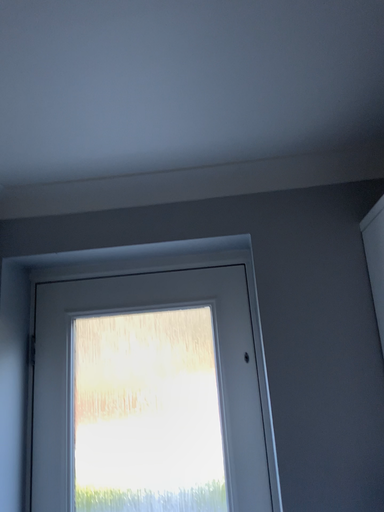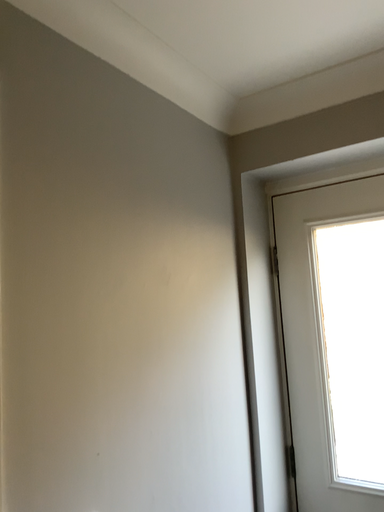
Question: Which way did the camera rotate in the video?

Choices:
 (A) rotated downward
 (B) rotated upward

Answer: (A)